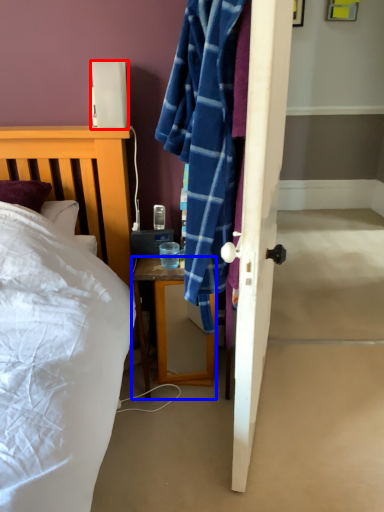
Question: Which point is further to the camera, lamp (highlighted by a red box) or desk (highlighted by a blue box)?

Choices:
 (A) lamp
 (B) desk

Answer: (B)